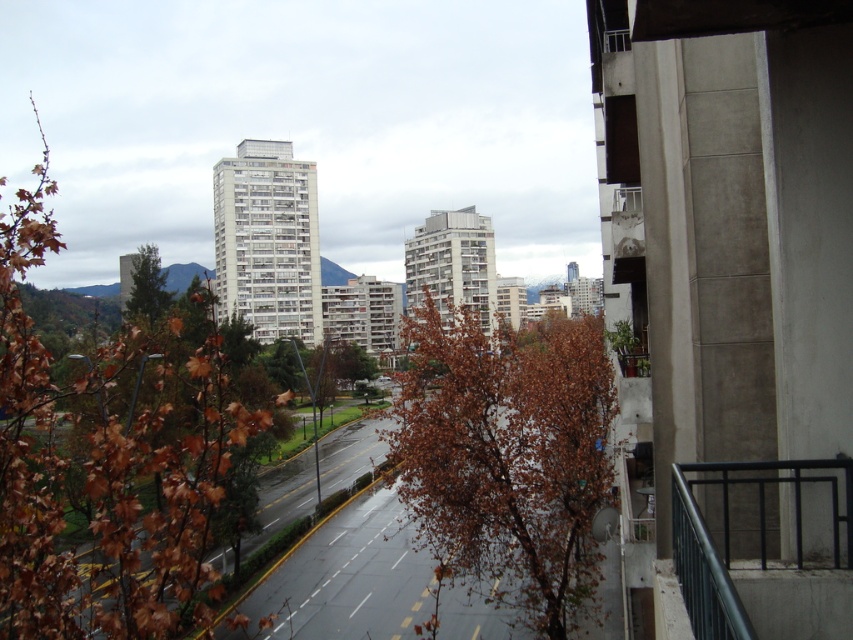
Question: Which point is closer to the camera?

Choices:
 (A) green leafy tree at left
 (B) brown leafy tree at upper left
 (C) brown leafy tree at center

Answer: (B)

Question: Can you confirm if brown leafy tree at upper left is thinner than green leafy tree at left?

Choices:
 (A) no
 (B) yes

Answer: (A)

Question: Is the position of brown leafy tree at center more distant than that of green leafy tree at left?

Choices:
 (A) no
 (B) yes

Answer: (A)

Question: Which point is closer to the camera?

Choices:
 (A) (593, 380)
 (B) (142, 246)

Answer: (A)

Question: Is brown leafy tree at upper left to the right of green leafy tree at left from the viewer's perspective?

Choices:
 (A) yes
 (B) no

Answer: (B)

Question: Which point is farther to the camera?

Choices:
 (A) (169, 304)
 (B) (186, 426)
 (C) (508, 474)

Answer: (A)